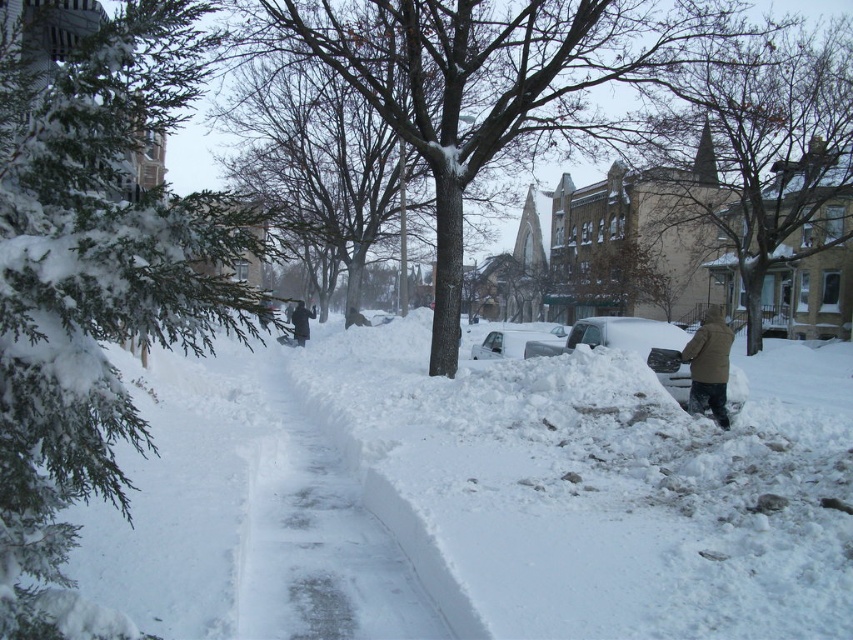
Is snow-covered tree at center positioned at the back of black fabric coat at center?

No, snow-covered tree at center is closer to the viewer.

Who is lower down, snow-covered tree at center or black fabric coat at center?

black fabric coat at center is below.

The height and width of the screenshot is (640, 853). Find the location of `snow-covered tree at center`. snow-covered tree at center is located at coordinates (488, 80).

Is green textured evergreen at left further to camera compared to snow-covered tree at center?

No, green textured evergreen at left is closer to the viewer.

Can you confirm if green textured evergreen at left is smaller than snow-covered tree at center?

Yes.

Is point (167, 77) in front of point (606, 67)?

Yes.

Image resolution: width=853 pixels, height=640 pixels. Identify the location of green textured evergreen at left. (96, 285).

Which is behind, point (45, 161) or point (310, 310)?

Positioned behind is point (310, 310).

You are a GUI agent. You are given a task and a screenshot of the screen. Output one action in this format:
    pyautogui.click(x=<x>, y=<y>)
    Task: Click on the green textured evergreen at left
    Image resolution: width=853 pixels, height=640 pixels.
    Given the screenshot: What is the action you would take?
    pyautogui.click(x=96, y=285)

Who is more distant from viewer, (6, 444) or (305, 332)?

Point (305, 332)

Find the location of a particular element. green textured evergreen at left is located at coordinates (96, 285).